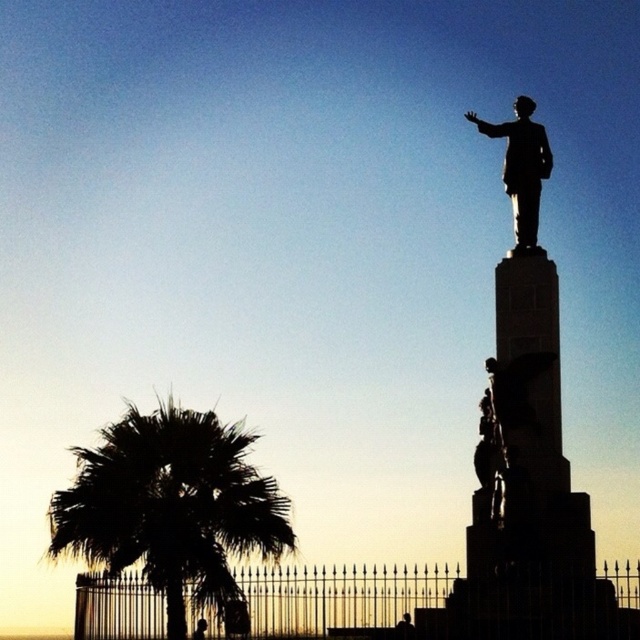
Question: Can you confirm if black leafy palm tree at lower left is wider than polished bronze statue at upper right?

Choices:
 (A) no
 (B) yes

Answer: (B)

Question: Which object is farther from the camera taking this photo?

Choices:
 (A) black leafy palm tree at lower left
 (B) polished bronze statue at upper right

Answer: (B)

Question: Does black leafy palm tree at lower left have a greater width compared to polished bronze statue at upper right?

Choices:
 (A) yes
 (B) no

Answer: (A)

Question: Does black leafy palm tree at lower left have a lesser width compared to polished bronze statue at upper right?

Choices:
 (A) yes
 (B) no

Answer: (B)